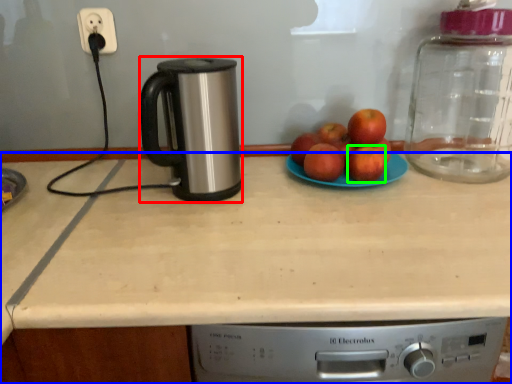
Question: Which object is the closest to the kitchen appliance (highlighted by a red box)? Choose among these: countertop (highlighted by a blue box) or apple (highlighted by a green box).

Choices:
 (A) countertop
 (B) apple

Answer: (A)